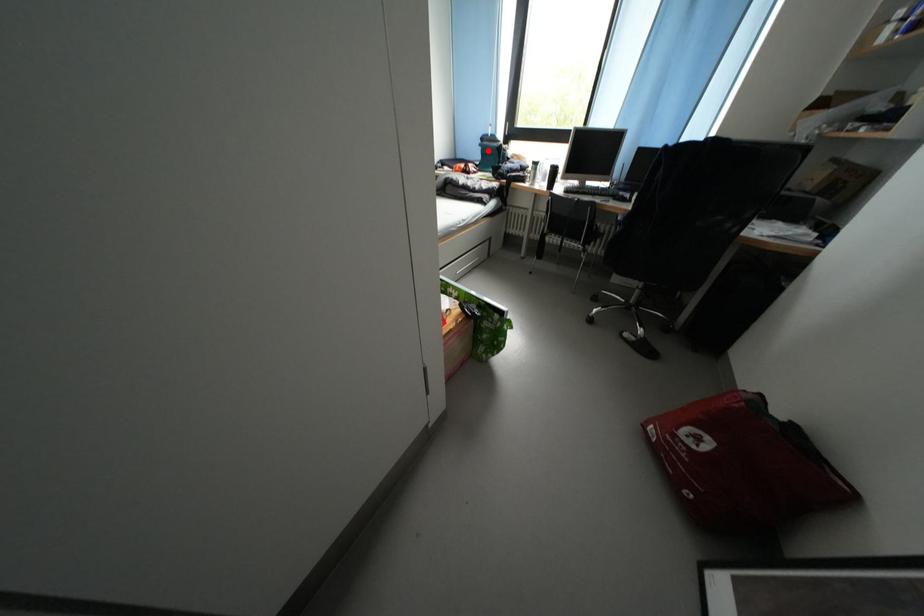
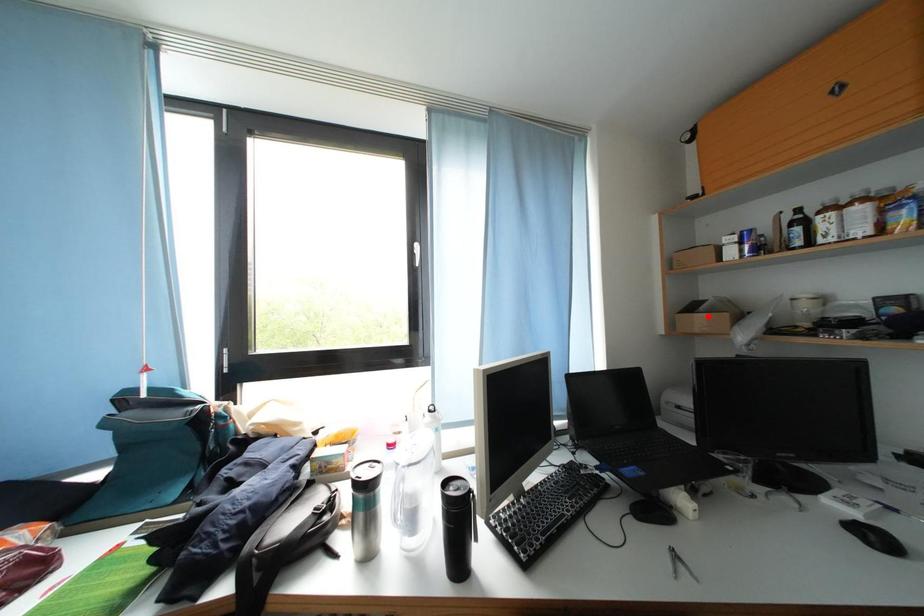
I am providing you with two images of the same scene from different viewpoints. A red point is marked on the first image and another point is marked on the second image. Is the marked point in image1 the same physical position as the marked point in image2?

No